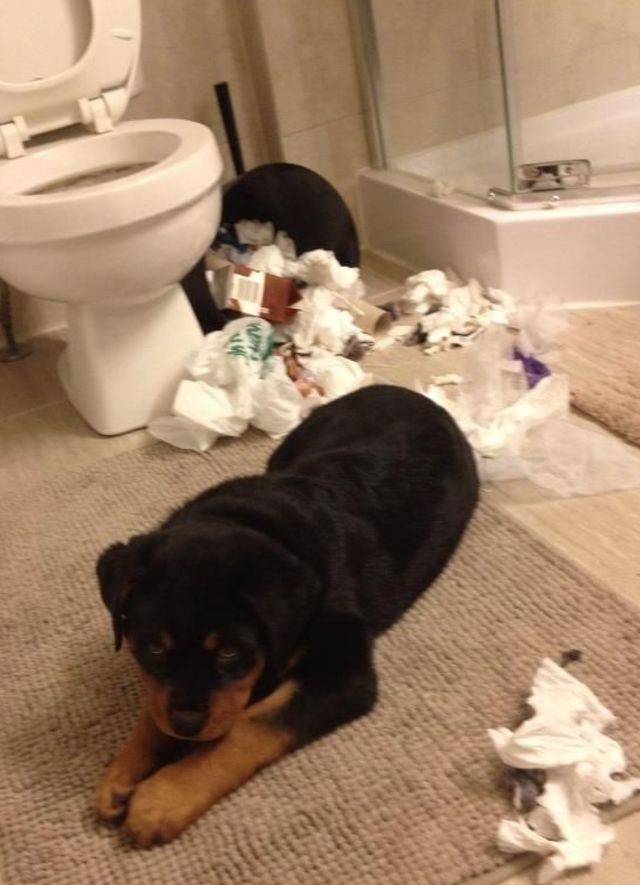
Find the location of a particular element. This screenshot has width=640, height=885. handle is located at coordinates (230, 127).